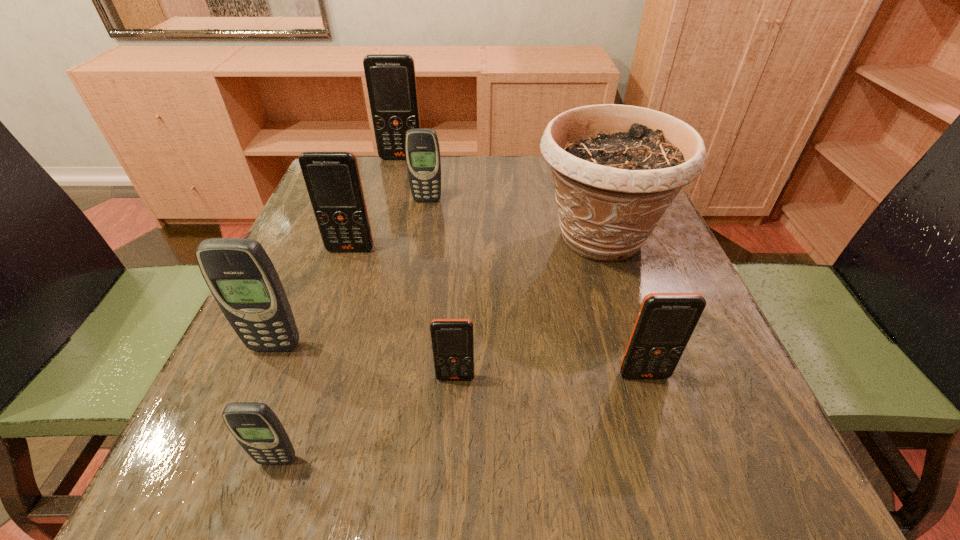
The height and width of the screenshot is (540, 960). Find the location of `the second smallest orange cellular telephone`. the second smallest orange cellular telephone is located at coordinates (665, 322).

Locate an element on the screen. The height and width of the screenshot is (540, 960). the sixth object from left to right is located at coordinates (452, 340).

What are the coordinates of `the second orange cellular telephone from right to left` in the screenshot? It's located at (452, 340).

The height and width of the screenshot is (540, 960). Identify the location of the nearest gray cellular telephone. (255, 426).

The height and width of the screenshot is (540, 960). Find the location of `the nearest object`. the nearest object is located at coordinates (255, 426).

Find the location of a particular element. This screenshot has height=540, width=960. blank area located on the screen of the biggest orange cellular telephone is located at coordinates (385, 221).

Identify the location of free space located 0.360m on the left of the flowerpot. (366, 238).

You are a GUI agent. You are given a task and a screenshot of the screen. Output one action in this format:
    pyautogui.click(x=<x>, y=<y>)
    Task: Click on the free space located on the screen of the fifth nearest cellular telephone
    Image resolution: width=960 pixels, height=540 pixels.
    Given the screenshot: What is the action you would take?
    pyautogui.click(x=336, y=294)

Find the location of a particular element. vacant space situated on the screen of the second nearest gray cellular telephone is located at coordinates (228, 458).

At what (x,y) coordinates should I click in order to perform the action: click on vacant area situated on the screen of the second smallest gray cellular telephone. Please return your answer as a coordinate pair (x, y). The height and width of the screenshot is (540, 960). Looking at the image, I should click on (x=407, y=327).